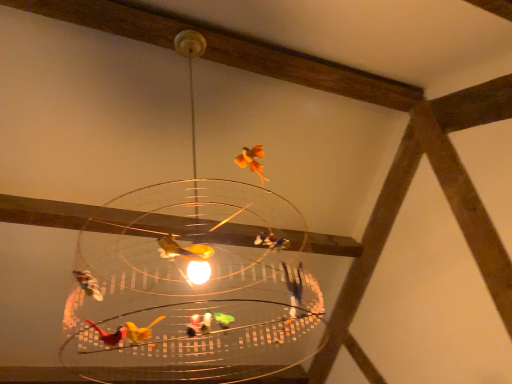
Identify the location of transparent glass lamp at center. The width and height of the screenshot is (512, 384). (192, 282).

The height and width of the screenshot is (384, 512). Describe the element at coordinates (192, 282) in the screenshot. I see `transparent glass lamp at center` at that location.

Measure the distance between point (179, 36) and camera.

1.83 meters.

Where is `transparent glass lamp at center`? This screenshot has width=512, height=384. transparent glass lamp at center is located at coordinates (192, 282).